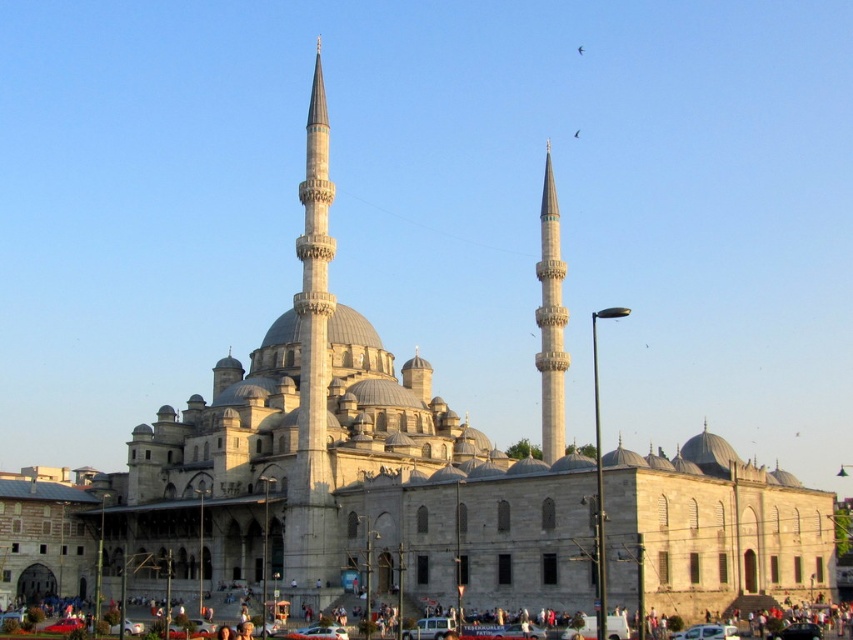
Question: Is gray stone minaret at center bigger than white stone minaret at center?

Choices:
 (A) yes
 (B) no

Answer: (A)

Question: From the image, what is the correct spatial relationship of gray stone minaret at center in relation to white stone minaret at center?

Choices:
 (A) left
 (B) right

Answer: (A)

Question: Considering the relative positions of gray stone minaret at center and white stone minaret at center in the image provided, where is gray stone minaret at center located with respect to white stone minaret at center?

Choices:
 (A) above
 (B) below

Answer: (A)

Question: Among these points, which one is nearest to the camera?

Choices:
 (A) (547, 250)
 (B) (310, 458)

Answer: (B)

Question: Which of the following is the closest to the observer?

Choices:
 (A) gray stone minaret at center
 (B) white stone minaret at center

Answer: (A)